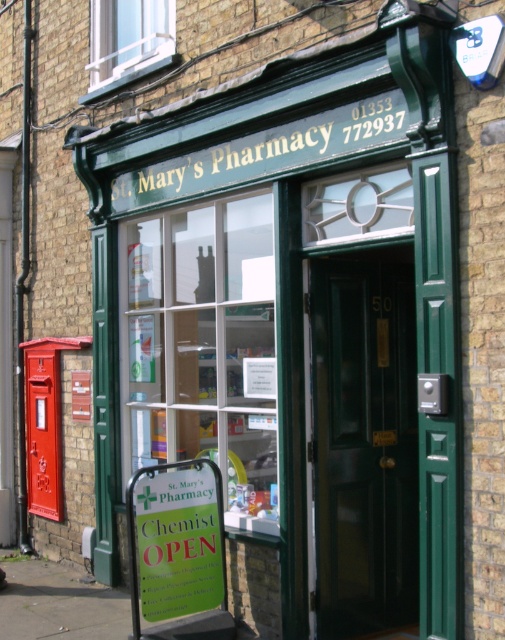
You are standing in front of St. Mary Pharmacy and need to locate two specific points marked on the facade. The first point is at coordinate point (405, 522) and the second at point (208, 518). Which point is closer to the entrance of the pharmacy?

Point (208, 518) is closer to the entrance of the pharmacy because it is in front of point (405, 522).

You are a delivery person trying to deliver a package to St. Mary Pharmacy. You see the shiny dark wood door at center and the green paper sign at lower center. Which object should you interact with to enter the pharmacy?

The shiny dark wood door at center is wider than the green paper sign at lower center, so you should interact with the shiny dark wood door at center to enter the pharmacy.

What is the spatial relationship between the shiny dark wood door at center and the green paper sign at lower center in the pharmacy storefront?

The shiny dark wood door at center is located to the right of the green paper sign at lower center.